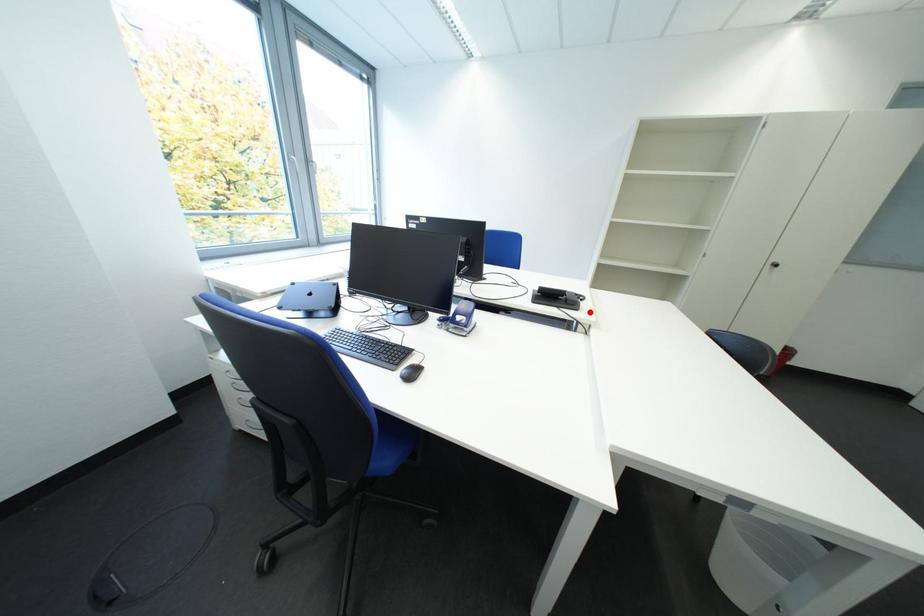
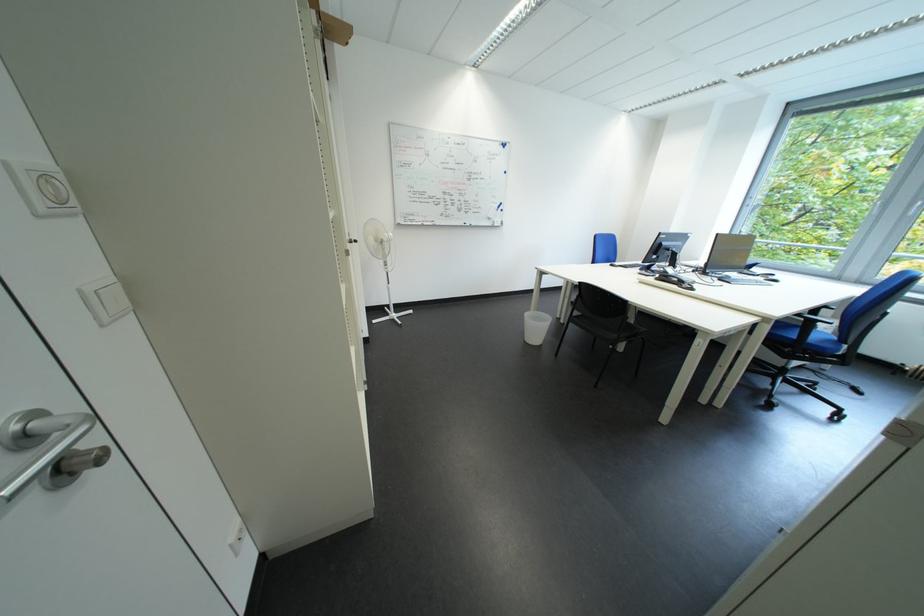
The point at the highlighted location is marked in the first image. Where is the corresponding point in the second image?

(669, 282)